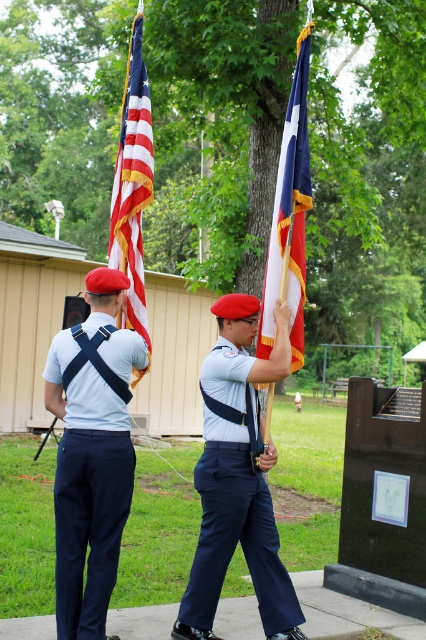
During the flag ceremony, you notice two flags being held by the individuals. Which flag is smaller in size between the blue fabric flag at center and the american flag at left?

The blue fabric flag at center is smaller in size compared to the american flag at left.

In the scene shown: You are a photographer trying to capture the flag ceremony. You notice the navy blue uniform at center and the american flag at left. Which object takes up more space in the photo?

The american flag at left takes up more space in the photo because the navy blue uniform at center occupies less space than the american flag at left.

You are a photographer at the flag ceremony. You need to capture a photo where both the blue fabric flag at center and the american flag at left are visible. Based on their positions, which flag should you ensure is placed on the left side of your photo to include both?

The blue fabric flag at center is to the right of the american flag at left. To include both in the photo, you should ensure the american flag at left is on the left side of the photo.